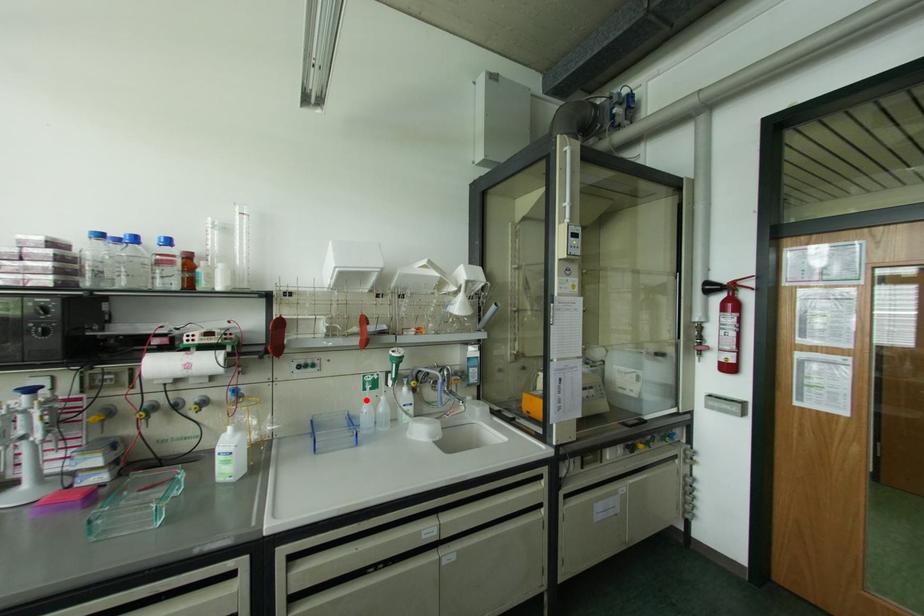
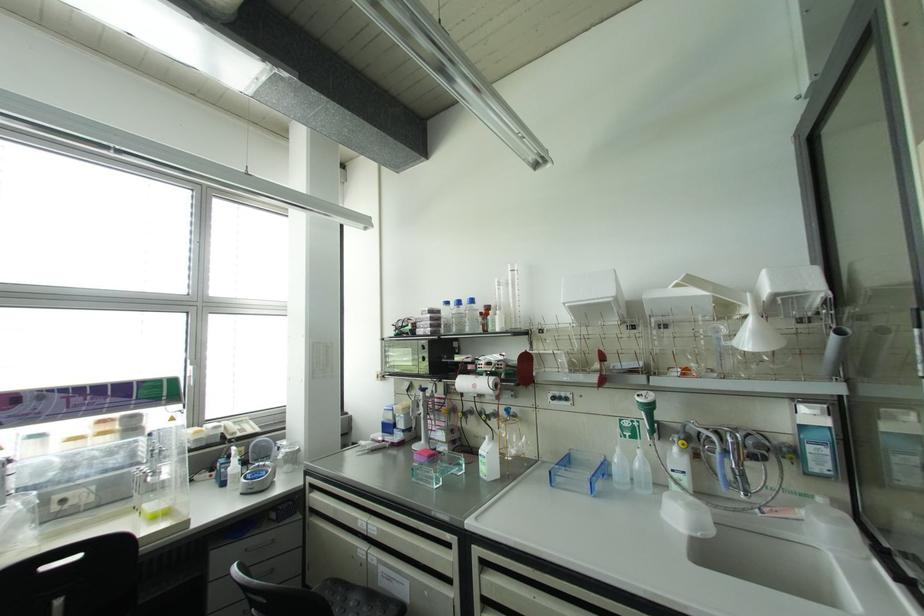
Locate, in the second image, the point that corresponds to the highlighted location in the first image.

(616, 448)